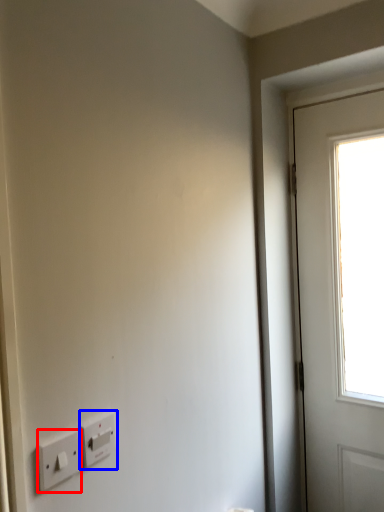
Question: Among these objects, which one is farthest to the camera, light switch (highlighted by a red box) or light switch (highlighted by a blue box)?

Choices:
 (A) light switch
 (B) light switch

Answer: (B)